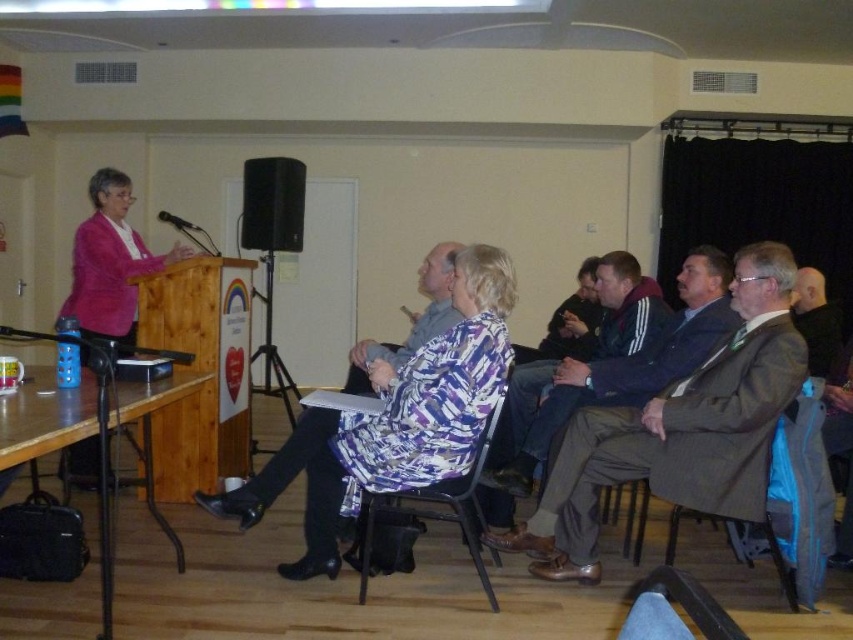
Is brown woolen suit at center positioned at the back of wooden table at lower left?

Yes.

Consider the image. Which of these two, brown woolen suit at center or wooden table at lower left, stands shorter?

wooden table at lower left is shorter.

This screenshot has height=640, width=853. I want to click on brown woolen suit at center, so click(680, 428).

Can you confirm if brown woolen suit at center is wider than black matte speaker at center?

Yes.

Is brown woolen suit at center above black matte speaker at center?

Incorrect, brown woolen suit at center is not positioned above black matte speaker at center.

Which is behind, point (610, 477) or point (270, 211)?

Positioned behind is point (270, 211).

I want to click on brown woolen suit at center, so click(680, 428).

Is point (570, 316) positioned before point (357, 556)?

No, (570, 316) is further to viewer.

From the picture: Can you confirm if dark blue jacket at center is positioned below metallic black chair at center?

No.

Which is in front, point (532, 412) or point (428, 516)?

Point (428, 516) is more forward.

In order to click on dark blue jacket at center in this screenshot , I will do `click(535, 420)`.